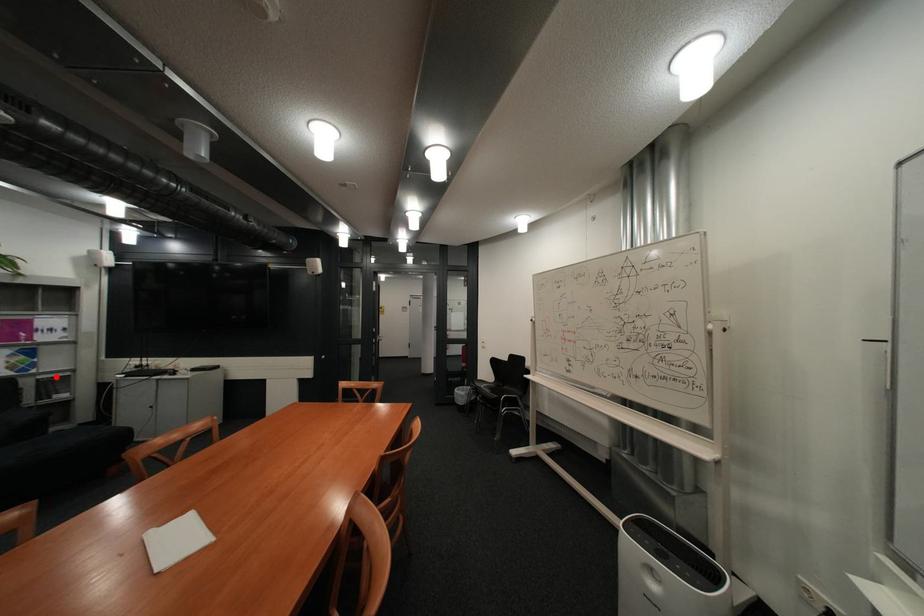
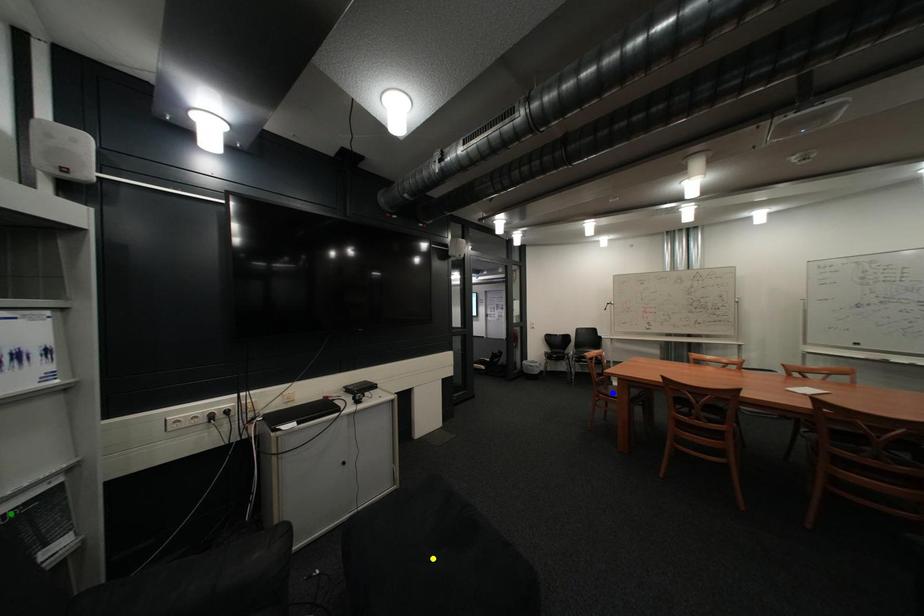
Question: I am providing you with two images of the same scene from different viewpoints. A red point is marked on the first image. You are given multiple points on the second image. Which spot in image 2 lines up with the point in image 1?

Choices:
 (A) green point
 (B) blue point
 (C) yellow point

Answer: (A)